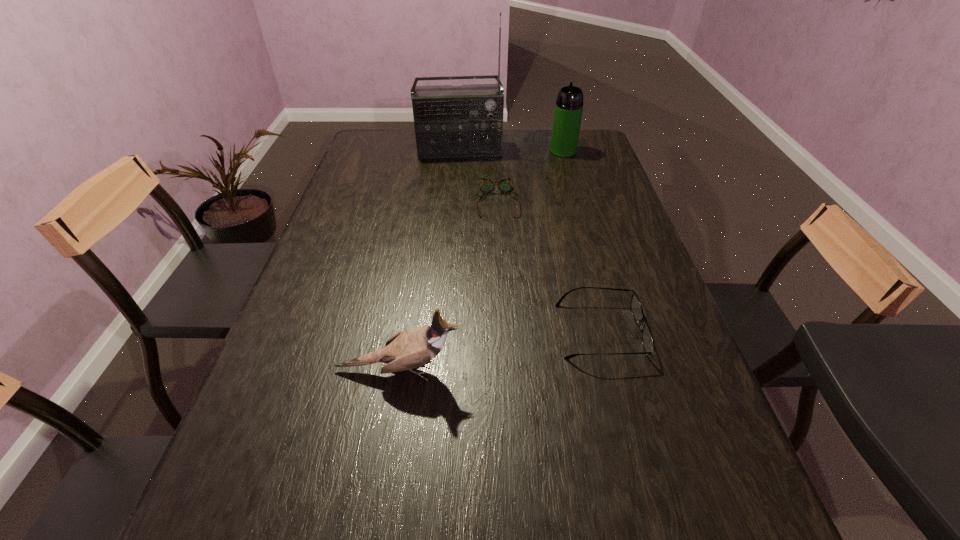
The height and width of the screenshot is (540, 960). I want to click on blank space located on the front-facing side of the farther spectacles, so click(x=500, y=267).

This screenshot has height=540, width=960. Identify the location of vacant area situated on the front panel of the radio receiver. (466, 197).

Locate an element on the screen. This screenshot has height=540, width=960. vacant space located 0.400m on the front panel of the radio receiver is located at coordinates (468, 225).

Locate an element on the screen. vacant space located on the front panel of the radio receiver is located at coordinates (464, 173).

Find the location of a particular element. This screenshot has width=960, height=540. vacant space situated from the spout of the thermos bottle is located at coordinates (555, 183).

Where is `blank space located 0.200m from the spout of the thermos bottle`? blank space located 0.200m from the spout of the thermos bottle is located at coordinates (554, 186).

The image size is (960, 540). In order to click on free space located from the spout of the thermos bottle in this screenshot , I will do `click(560, 167)`.

Locate an element on the screen. The image size is (960, 540). radio receiver that is at the far edge is located at coordinates (450, 121).

Where is `thermos bottle that is at the far edge`? Image resolution: width=960 pixels, height=540 pixels. thermos bottle that is at the far edge is located at coordinates (569, 105).

Locate an element on the screen. object situated at the left edge is located at coordinates (408, 349).